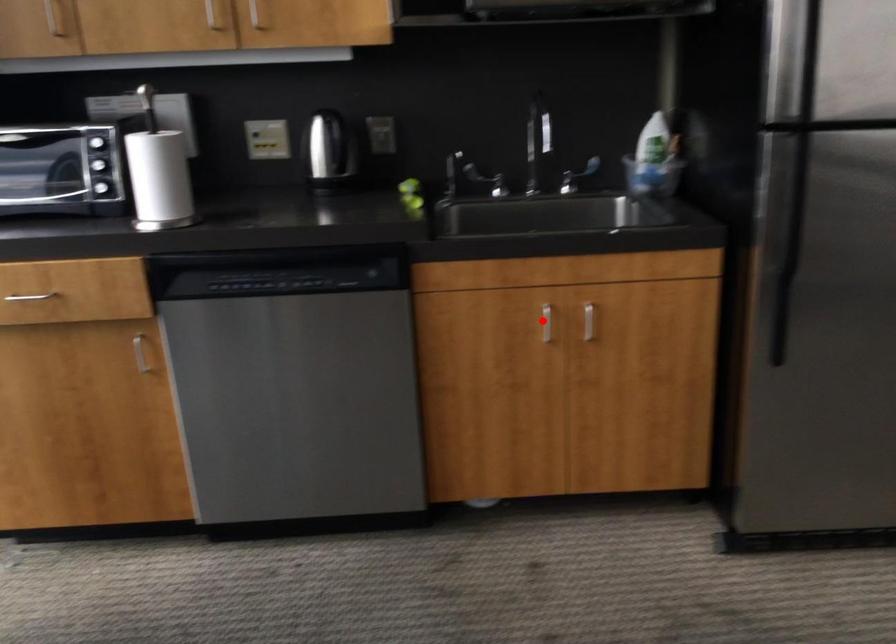
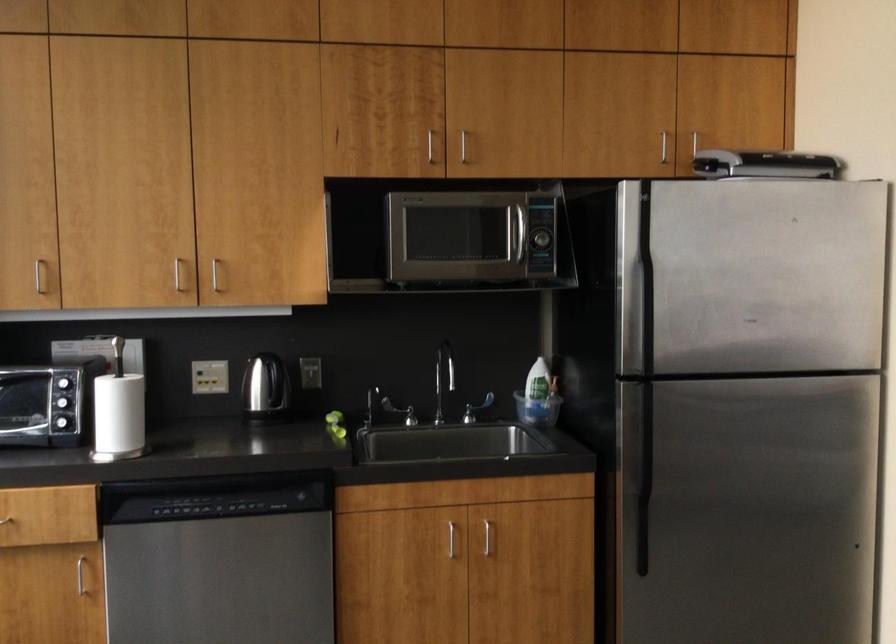
Question: I am providing you with two images of the same scene from different viewpoints. Given a red point in image1, look at the same physical point in image2. Is it:

Choices:
 (A) Closer to the viewpoint
 (B) Farther from the viewpoint

Answer: (B)